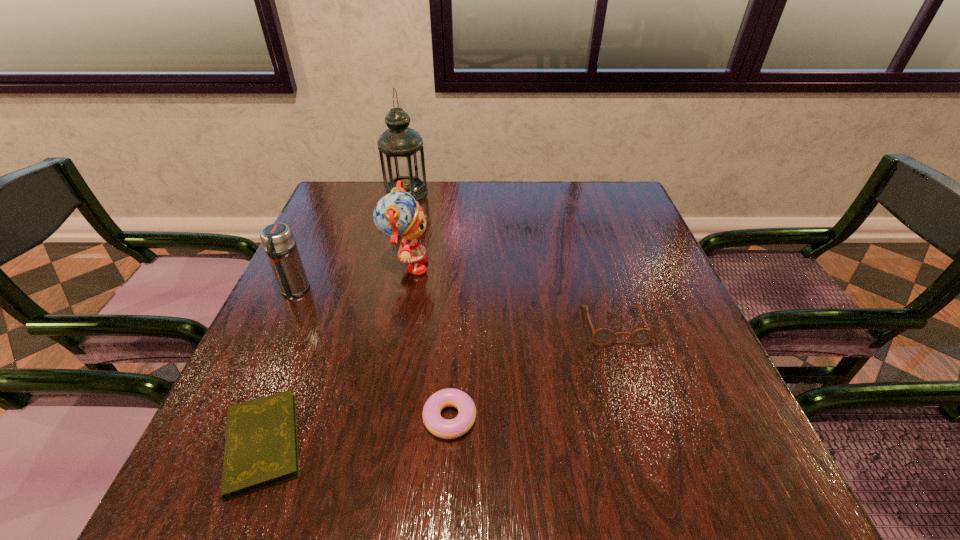
In order to click on the tallest object in this screenshot , I will do `click(401, 152)`.

Find the location of `oil lamp`. oil lamp is located at coordinates (401, 152).

Where is `doll`? This screenshot has width=960, height=540. doll is located at coordinates (397, 215).

The image size is (960, 540). What are the coordinates of `the third tallest object` in the screenshot? It's located at (278, 241).

The image size is (960, 540). In order to click on spectacles in this screenshot , I will do `click(602, 337)`.

At what (x,y) coordinates should I click in order to perform the action: click on the rightmost object. Please return your answer as a coordinate pair (x, y). Looking at the image, I should click on (602, 337).

This screenshot has height=540, width=960. What are the coordinates of `the second shortest object` in the screenshot? It's located at (443, 428).

This screenshot has width=960, height=540. In order to click on the fifth object from left to right in this screenshot , I will do `click(443, 428)`.

You are a GUI agent. You are given a task and a screenshot of the screen. Output one action in this format:
    pyautogui.click(x=<x>, y=<y>)
    Task: Click on the diary
    The image size is (960, 540).
    Given the screenshot: What is the action you would take?
    pyautogui.click(x=261, y=444)

Where is `vacant space located 0.220m on the right of the tallest object`? vacant space located 0.220m on the right of the tallest object is located at coordinates (499, 193).